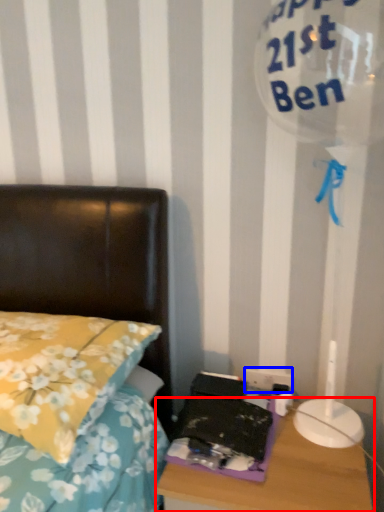
Question: Which point is closer to the camera, nightstand (highlighted by a red box) or electric outlet (highlighted by a blue box)?

Choices:
 (A) nightstand
 (B) electric outlet

Answer: (A)